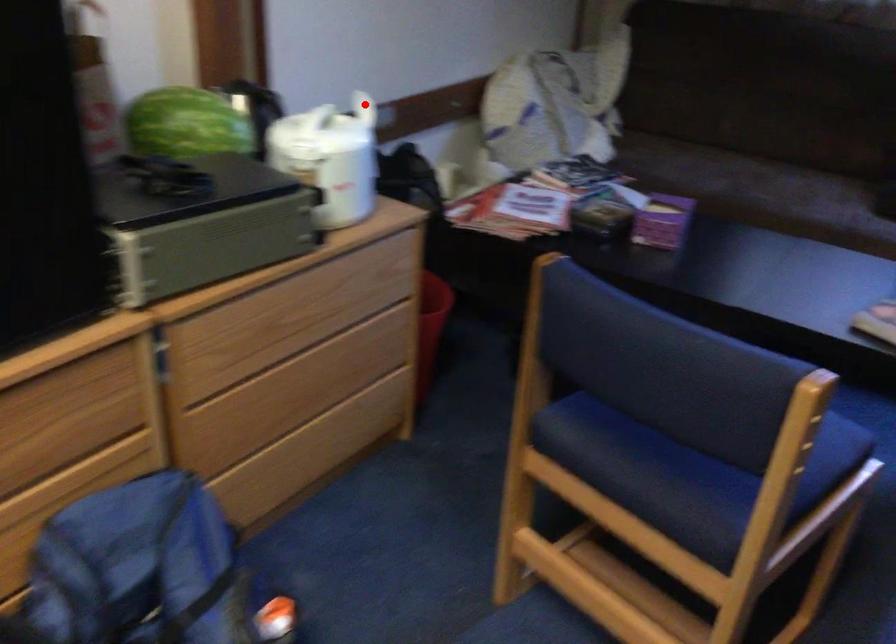
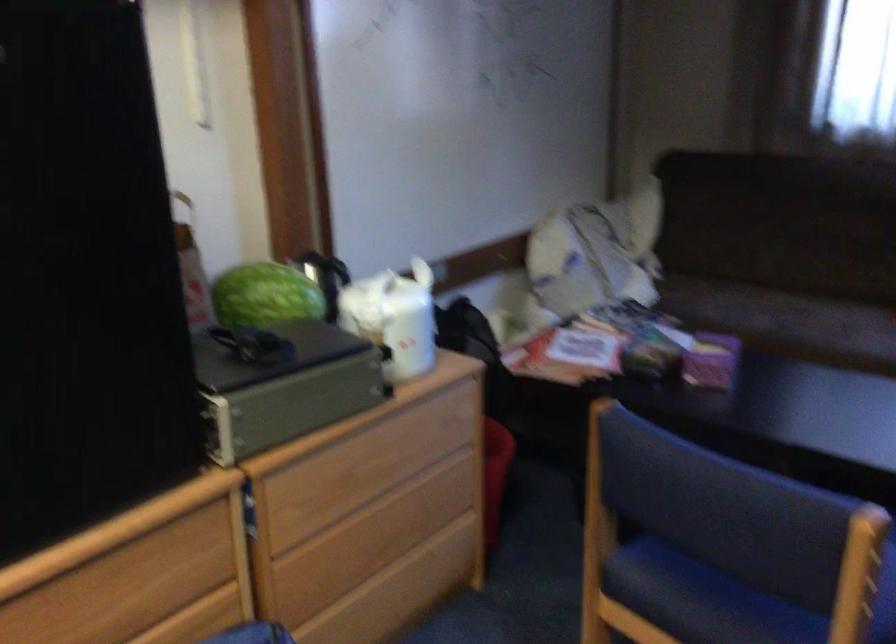
Where in the second image is the point corresponding to the highlighted location from the first image?

(426, 270)